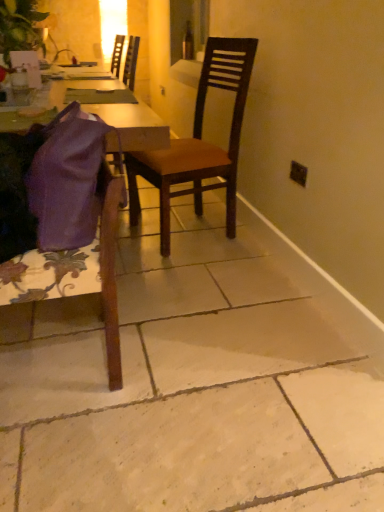
At what (x,y) coordinates should I click in order to perform the action: click on vacant area located to the right-hand side of purple fabric bag at lower left, the 2th chair from the back. Please return your answer as a coordinate pair (x, y). The width and height of the screenshot is (384, 512). Looking at the image, I should click on (178, 366).